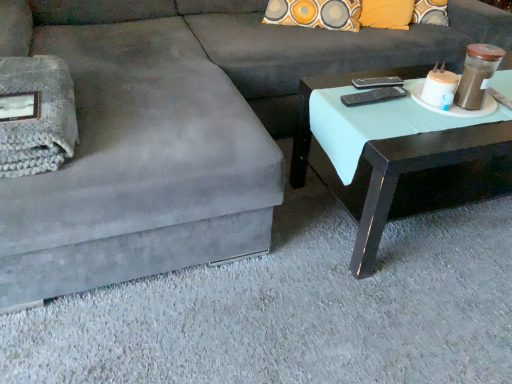
Where is `free space to the back side of black plastic remote at upper right, the 1th remote in the front-to-back sequence`? Image resolution: width=512 pixels, height=384 pixels. free space to the back side of black plastic remote at upper right, the 1th remote in the front-to-back sequence is located at coordinates (377, 86).